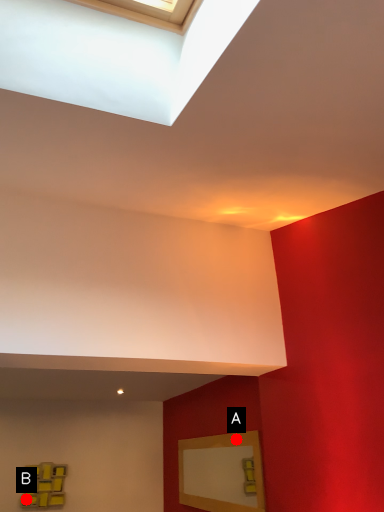
Question: Two points are circled on the image, labeled by A and B beside each circle. Which point is closer to the camera?

Choices:
 (A) A is closer
 (B) B is closer

Answer: (A)